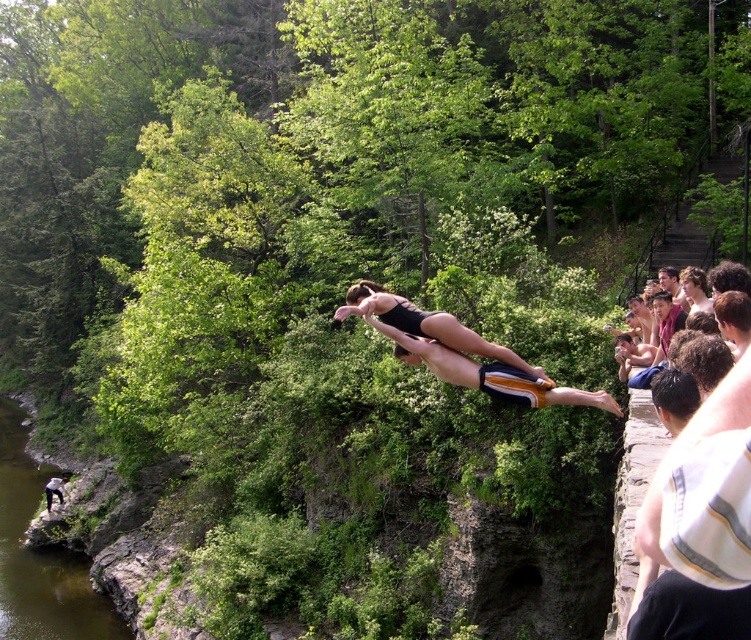
Can you confirm if white striped shirt at right is taller than green smooth water at lower left?

Incorrect, white striped shirt at right's height is not larger of green smooth water at lower left's.

Find the location of a particular element. white striped shirt at right is located at coordinates click(x=698, y=525).

Can you confirm if green smooth water at lower left is bigger than matte black swim trunks at center?

Yes, green smooth water at lower left is bigger than matte black swim trunks at center.

Is green smooth water at lower left further to the viewer compared to matte black swim trunks at center?

No, green smooth water at lower left is in front of matte black swim trunks at center.

Describe the element at coordinates (41, 556) in the screenshot. The height and width of the screenshot is (640, 751). I see `green smooth water at lower left` at that location.

This screenshot has width=751, height=640. What are the coordinates of `green smooth water at lower left` in the screenshot? It's located at (41, 556).

Does white striped shirt at right appear over matte black swim trunks at center?

Correct, white striped shirt at right is located above matte black swim trunks at center.

Who is higher up, white striped shirt at right or matte black swim trunks at center?

white striped shirt at right is higher up.

Between point (746, 632) and point (47, 499), which one is positioned behind?

The point (47, 499) is more distant.

Where is `white striped shirt at right`? white striped shirt at right is located at coordinates click(698, 525).